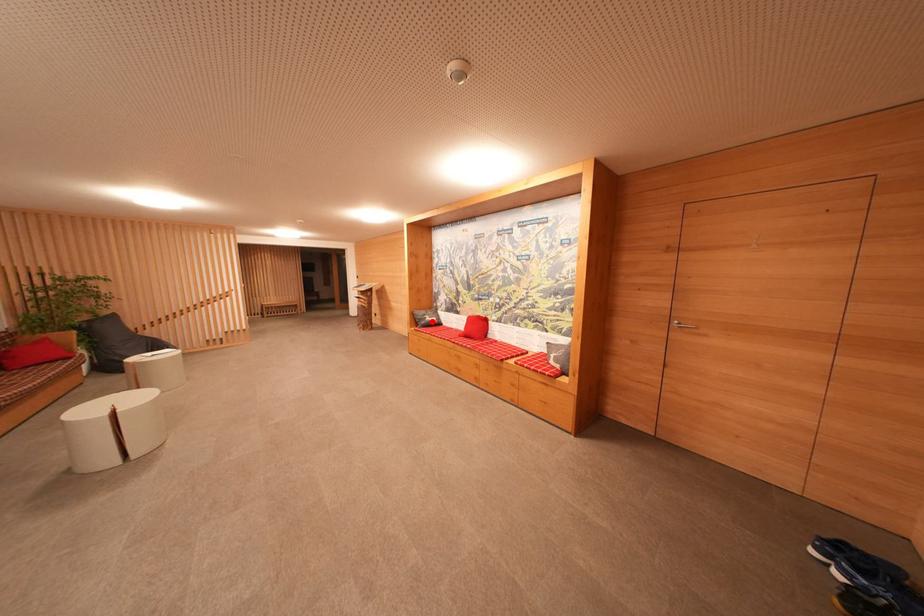
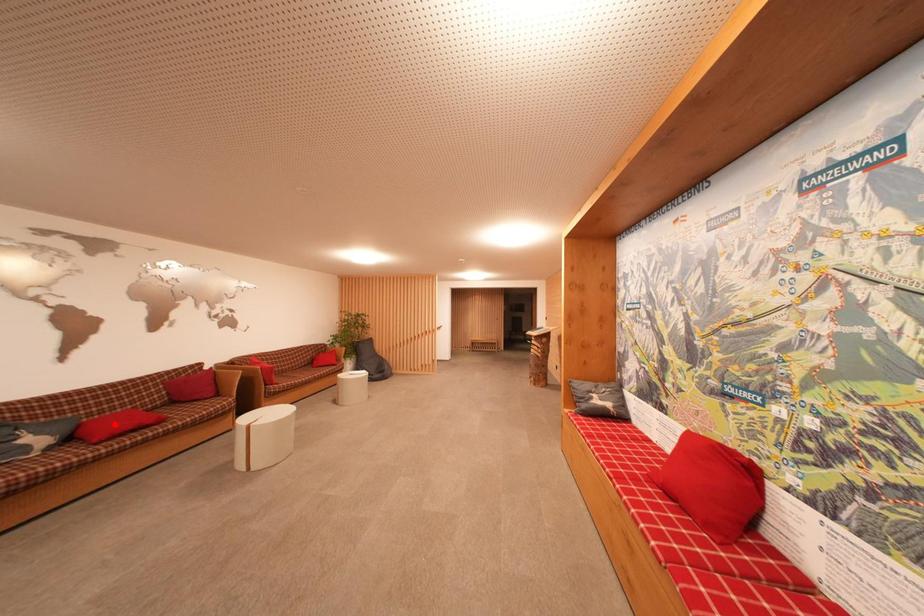
I am providing you with two images of the same scene from different viewpoints. A red point is marked on the first image and another point is marked on the second image. Are the points marked in image1 and image2 representing the same 3D position?

No